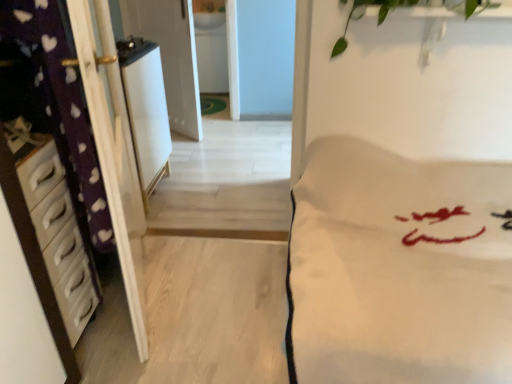
Find the location of a particular element. The image size is (512, 384). white plastic chest of drawers at left is located at coordinates (57, 231).

This screenshot has width=512, height=384. Identify the location of white glossy sink at upper center. (208, 14).

Find the location of `white glossy refrigerator at center`. white glossy refrigerator at center is located at coordinates (146, 109).

From a real-world perspective, which is physically below, white soft fabric at center or white glossy screen door at upper center?

In real-world perspective, white soft fabric at center is lower.

Can you confirm if white soft fabric at center is smaller than white glossy screen door at upper center?

No, white soft fabric at center is not smaller than white glossy screen door at upper center.

Is white soft fabric at center placed right next to white glossy screen door at upper center?

No, white soft fabric at center is not beside white glossy screen door at upper center.

Can you tell me how much white soft fabric at center and white glossy screen door at upper center differ in facing direction?

40 degrees separate the facing orientations of white soft fabric at center and white glossy screen door at upper center.

Considering the sizes of white glossy screen door at upper center and white plastic chest of drawers at left in the image, is white glossy screen door at upper center taller or shorter than white plastic chest of drawers at left?

In the image, white glossy screen door at upper center appears to be taller than white plastic chest of drawers at left.

Which of these two, white glossy screen door at upper center or white plastic chest of drawers at left, is smaller?

Smaller between the two is white plastic chest of drawers at left.

Which is behind, white glossy screen door at upper center or white plastic chest of drawers at left?

white glossy screen door at upper center is further away from the camera.

Is point (188, 16) positioned in front of point (76, 238)?

That is False.

Which of these two, white glossy refrigerator at center or white glossy sink at upper center, stands shorter?

white glossy sink at upper center.

How many degrees apart are the facing directions of white glossy refrigerator at center and white glossy sink at upper center?

The angular difference between white glossy refrigerator at center and white glossy sink at upper center is 80.4 degrees.

Would you consider white glossy refrigerator at center to be distant from white glossy sink at upper center?

Yes, white glossy refrigerator at center and white glossy sink at upper center are located far from each other.

Considering the sizes of white glossy refrigerator at center and white glossy sink at upper center in the image, is white glossy refrigerator at center bigger or smaller than white glossy sink at upper center?

Considering their sizes, white glossy refrigerator at center takes up more space than white glossy sink at upper center.

Between point (39, 201) and point (224, 22), which one is positioned in front?

The point (39, 201) is in front.

Is the surface of white plastic chest of drawers at left in direct contact with white glossy sink at upper center?

No, white plastic chest of drawers at left is not making contact with white glossy sink at upper center.

In the image, there is a white plastic chest of drawers at left. Identify the location of sink above it (from the image's perspective). (208, 14).

Looking at this image, is white plastic chest of drawers at left further to the viewer compared to white glossy sink at upper center?

No.

Which of these two, white glossy sink at upper center or green leafy plant at upper center, is bigger?

With larger size is green leafy plant at upper center.

From the image's perspective, is white glossy sink at upper center under green leafy plant at upper center?

→ Actually, white glossy sink at upper center appears above green leafy plant at upper center in the image.

This screenshot has width=512, height=384. I want to click on sink behind the green leafy plant at upper center, so (x=208, y=14).

Is white glossy sink at upper center taller or shorter than green leafy plant at upper center?

Considering their sizes, white glossy sink at upper center has less height than green leafy plant at upper center.

Who is taller, green leafy plant at upper center or white glossy screen door at upper center?

white glossy screen door at upper center is taller.

The image size is (512, 384). In the image, there is a white glossy screen door at upper center. Find the location of `plant below it (from the image's perspective)`. plant below it (from the image's perspective) is located at coordinates (364, 14).

Would you say green leafy plant at upper center is to the left or to the right of white glossy screen door at upper center in the picture?

green leafy plant at upper center is to the right of white glossy screen door at upper center.

Could white glossy screen door at upper center be considered to be inside green leafy plant at upper center?

Actually, white glossy screen door at upper center is outside green leafy plant at upper center.

Considering the relative positions of white glossy refrigerator at center and white glossy screen door at upper center in the image provided, is white glossy refrigerator at center to the right of white glossy screen door at upper center from the viewer's perspective?

Yes.

Would you consider white glossy refrigerator at center to be distant from white glossy screen door at upper center?

No, white glossy refrigerator at center is not far away from white glossy screen door at upper center.

Is white glossy refrigerator at center aimed at white glossy screen door at upper center?

No, white glossy refrigerator at center is not oriented towards white glossy screen door at upper center.

Can you confirm if white glossy refrigerator at center is taller than white glossy screen door at upper center?

Incorrect, the height of white glossy refrigerator at center is not larger of that of white glossy screen door at upper center.

This screenshot has width=512, height=384. What are the coordinates of `mattress that appears in front of the white glossy screen door at upper center` in the screenshot? It's located at (399, 269).

Identify the location of screen door above the white plastic chest of drawers at left (from a real-world perspective). (170, 55).

Based on their spatial positions, is white plastic chest of drawers at left or white glossy sink at upper center further from white glossy screen door at upper center?

Based on the image, white plastic chest of drawers at left appears to be further to white glossy screen door at upper center.

Looking at the image, which one is located further to green leafy plant at upper center, white glossy sink at upper center or white plastic chest of drawers at left?

white glossy sink at upper center.

Looking at the image, which one is located further to white soft fabric at center, white glossy refrigerator at center or green leafy plant at upper center?

white glossy refrigerator at center.

Looking at the image, which one is located further to white glossy refrigerator at center, green leafy plant at upper center or white glossy sink at upper center?

white glossy sink at upper center lies further to white glossy refrigerator at center than the other object.

Looking at the image, which one is located further to white glossy refrigerator at center, white glossy screen door at upper center or white glossy sink at upper center?

white glossy sink at upper center lies further to white glossy refrigerator at center than the other object.

From the picture: When comparing their distances from white glossy refrigerator at center, does white glossy sink at upper center or green leafy plant at upper center seem further?

white glossy sink at upper center is further to white glossy refrigerator at center.

Based on their spatial positions, is white glossy sink at upper center or white glossy refrigerator at center closer to green leafy plant at upper center?

white glossy refrigerator at center lies closer to green leafy plant at upper center than the other object.

Considering their positions, is white plastic chest of drawers at left positioned further to white glossy screen door at upper center than white glossy refrigerator at center?

Among the two, white plastic chest of drawers at left is located further to white glossy screen door at upper center.

Locate an element on the screen. The image size is (512, 384). screen door between white glossy refrigerator at center and white glossy sink at upper center from front to back is located at coordinates (170, 55).

Image resolution: width=512 pixels, height=384 pixels. I want to click on appliance between white plastic chest of drawers at left and green leafy plant at upper center from left to right, so click(146, 109).

Locate an element on the screen. appliance between green leafy plant at upper center and white glossy sink at upper center along the z-axis is located at coordinates (146, 109).

Image resolution: width=512 pixels, height=384 pixels. I want to click on plant between white plastic chest of drawers at left and white glossy screen door at upper center in the front-back direction, so click(x=364, y=14).